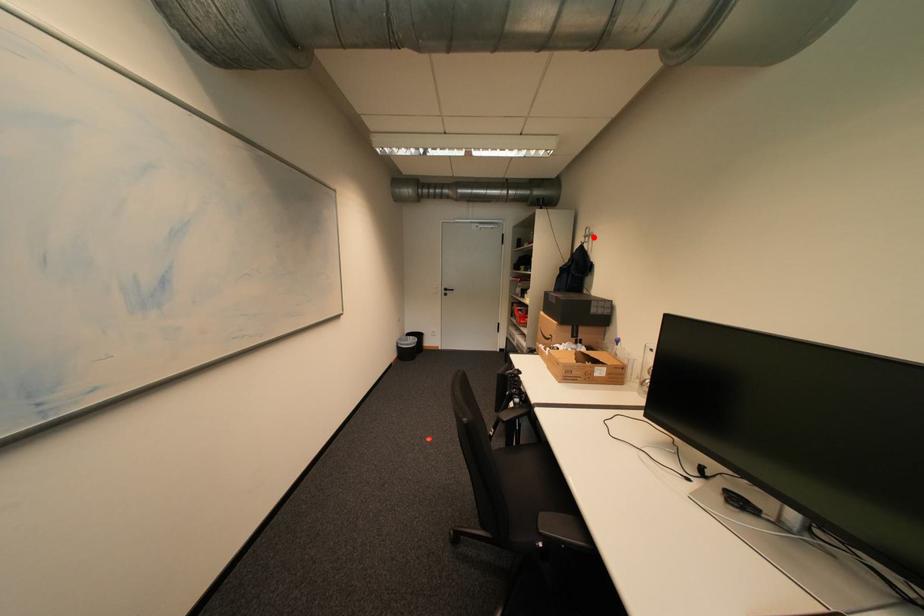
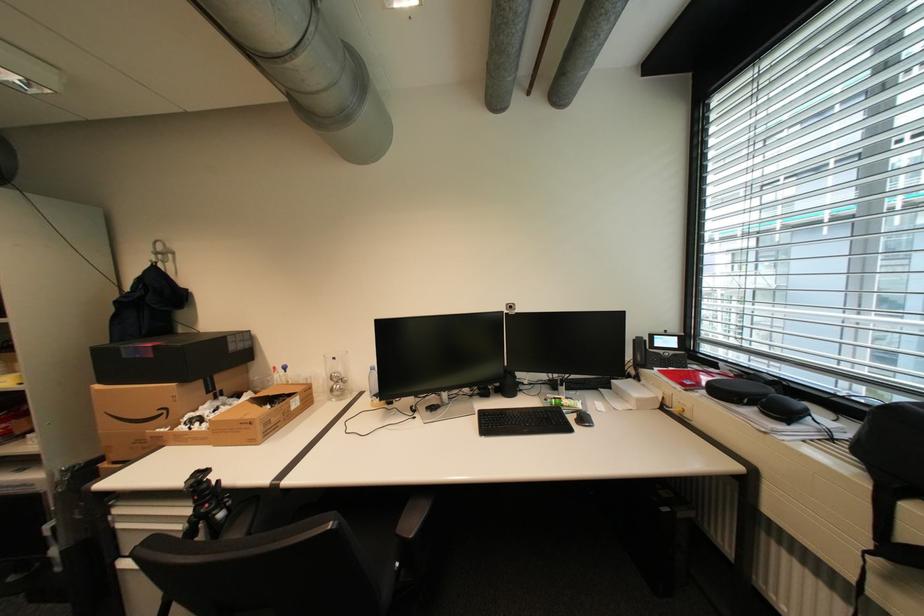
The point at the highlighted location is marked in the first image. Where is the corresponding point in the second image?

(165, 254)